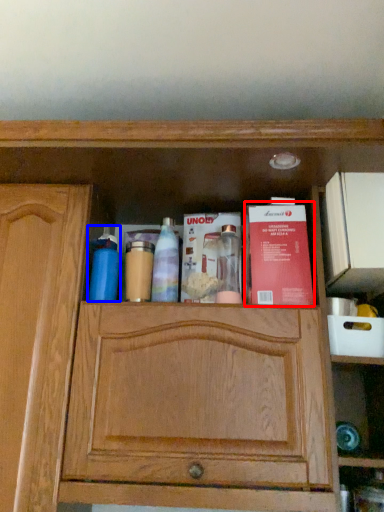
Question: Which of the following is the farthest to the observer, book (highlighted by a red box) or cleaning product (highlighted by a blue box)?

Choices:
 (A) book
 (B) cleaning product

Answer: (B)